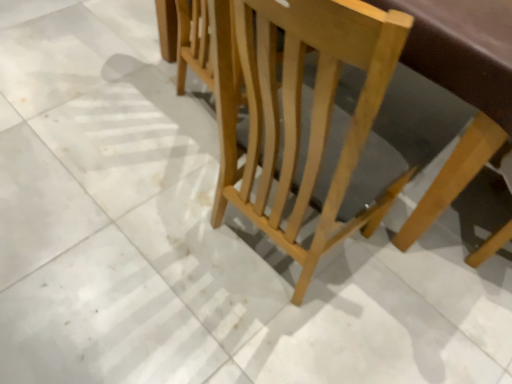
Question: Should I look upward or downward to see light wood chair at center?

Choices:
 (A) down
 (B) up

Answer: (B)